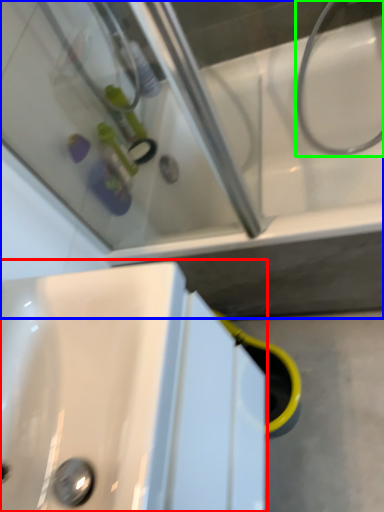
Question: Considering the real-world distances, which object is farthest from sink (highlighted by a red box)? bath (highlighted by a blue box) or plumbing fixture (highlighted by a green box)?

Choices:
 (A) bath
 (B) plumbing fixture

Answer: (B)